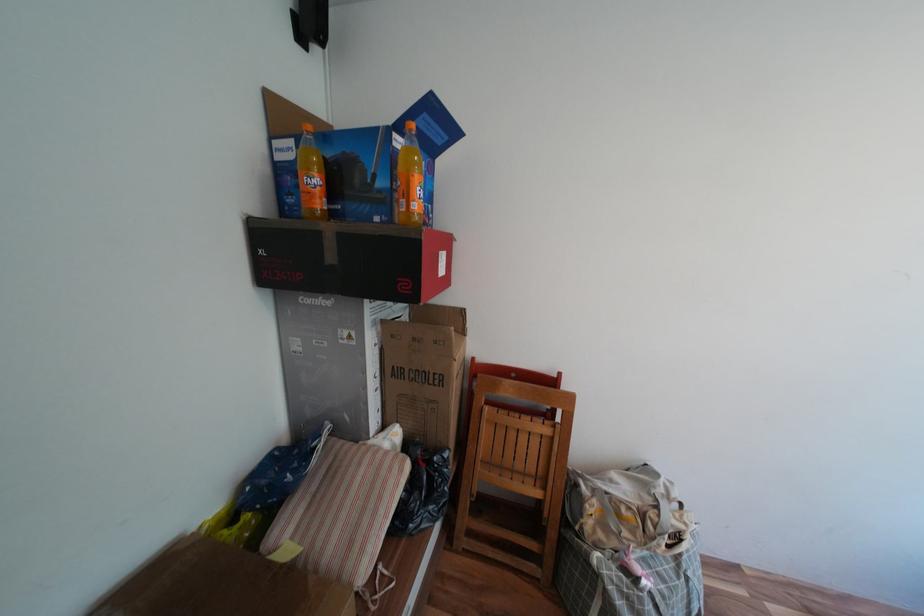
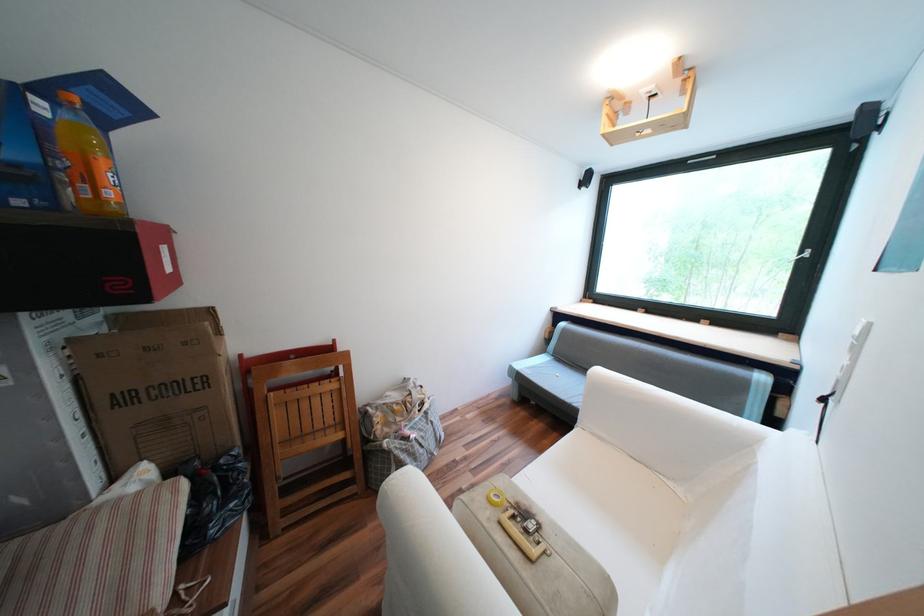
Locate, in the second image, the point that corresponds to the point at 424,206 in the first image.

(118, 193)